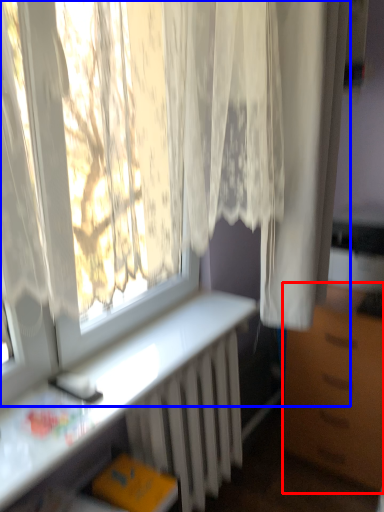
Question: Which point is further to the camera, furniture (highlighted by a red box) or curtain (highlighted by a blue box)?

Choices:
 (A) furniture
 (B) curtain

Answer: (A)